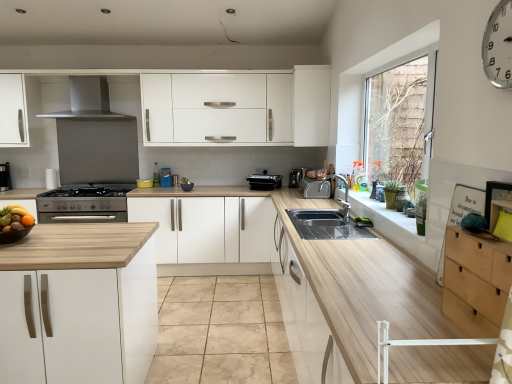
Question: Is satin silver stove at lower left, the 3th appliance in the right-to-left sequence, in front of or behind stainless steel exhaust hood at upper center in the image?

Choices:
 (A) front
 (B) behind

Answer: (B)

Question: In terms of size, does satin silver stove at lower left, which is the first appliance in left-to-right order, appear bigger or smaller than stainless steel exhaust hood at upper center?

Choices:
 (A) small
 (B) big

Answer: (A)

Question: Which object is the closest to the white metallic clock at upper right?

Choices:
 (A) satin silver stove at lower left, which is the first appliance in left-to-right order
 (B) satin silver toaster at center
 (C) shiny metallic bowl at left
 (D) beige marble granite at center
 (E) silver metallic tap at sink right

Answer: (E)

Question: Based on their relative distances, which object is farther from the stainless steel exhaust hood at upper center?

Choices:
 (A) shiny metallic bowl at left
 (B) white metallic clock at upper right
 (C) satin silver toaster at center, which is counted as the 1th appliance, starting from the right
 (D) white matte cabinet at center, placed as the first cabinetry when sorted from back to front
 (E) matte black coffee machine at left

Answer: (B)